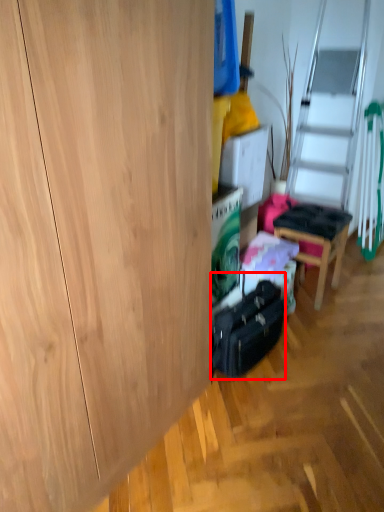
Question: From the image, what is the correct spatial relationship of luggage (annotated by the red box) in relation to chair?

Choices:
 (A) right
 (B) left

Answer: (B)